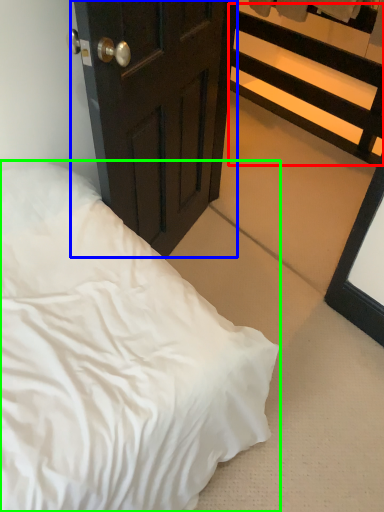
Question: Which object is the closest to the balustrade (highlighted by a red box)? Choose among these: door (highlighted by a blue box) or bed (highlighted by a green box).

Choices:
 (A) door
 (B) bed

Answer: (A)